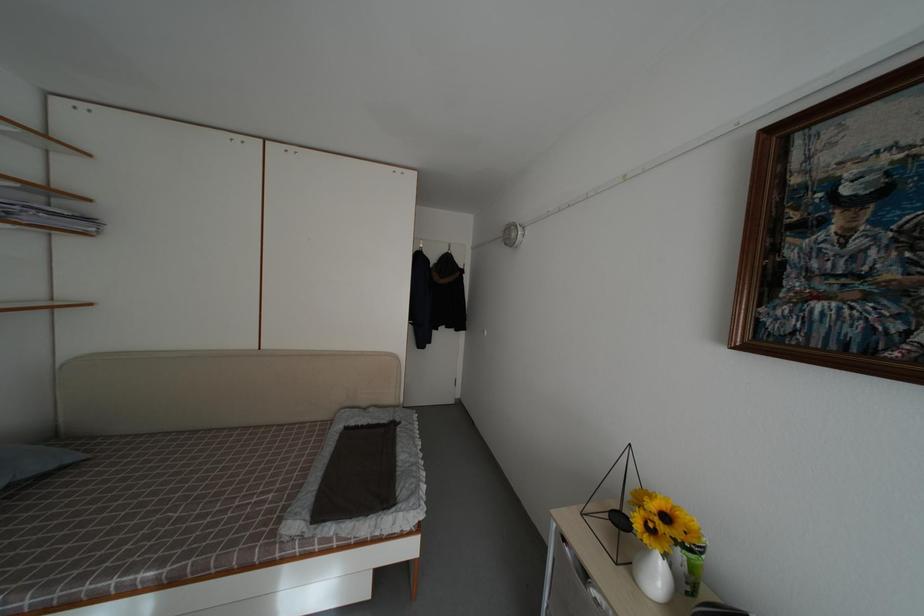
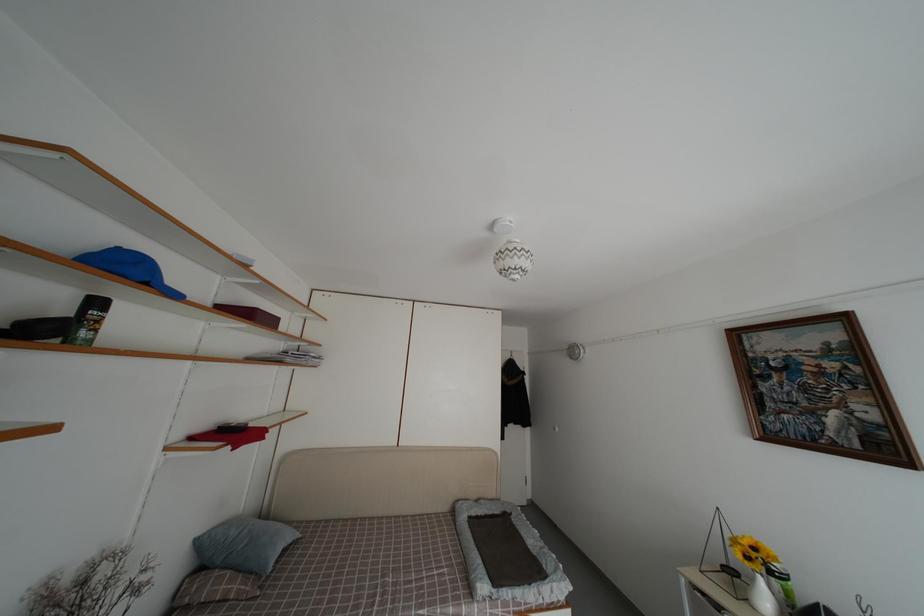
In a continuous first-person perspective shot, in which direction is the camera moving?

The cameraman moved toward left, backward.